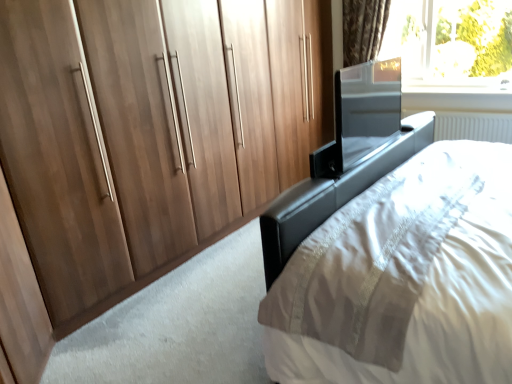
Question: Considering the relative sizes of walnut wood wardrobe at left and transparent glass window at upper right in the image provided, is walnut wood wardrobe at left taller than transparent glass window at upper right?

Choices:
 (A) no
 (B) yes

Answer: (B)

Question: Does walnut wood wardrobe at left come in front of transparent glass window at upper right?

Choices:
 (A) yes
 (B) no

Answer: (A)

Question: Is transparent glass window at upper right inside walnut wood wardrobe at left?

Choices:
 (A) yes
 (B) no

Answer: (B)

Question: From the image's perspective, is walnut wood wardrobe at left beneath transparent glass window at upper right?

Choices:
 (A) yes
 (B) no

Answer: (A)

Question: Is walnut wood wardrobe at left thinner than transparent glass window at upper right?

Choices:
 (A) no
 (B) yes

Answer: (A)

Question: Considering the relative sizes of walnut wood wardrobe at left and transparent glass window at upper right in the image provided, is walnut wood wardrobe at left bigger than transparent glass window at upper right?

Choices:
 (A) no
 (B) yes

Answer: (B)

Question: Is walnut wood wardrobe at left located outside black leather bed at center?

Choices:
 (A) no
 (B) yes

Answer: (B)

Question: From a real-world perspective, is walnut wood wardrobe at left positioned over black leather bed at center based on gravity?

Choices:
 (A) no
 (B) yes

Answer: (B)

Question: Is walnut wood wardrobe at left to the right of black leather bed at center from the viewer's perspective?

Choices:
 (A) yes
 (B) no

Answer: (B)

Question: Considering the relative positions of walnut wood wardrobe at left and black leather bed at center in the image provided, is walnut wood wardrobe at left to the left of black leather bed at center from the viewer's perspective?

Choices:
 (A) yes
 (B) no

Answer: (A)

Question: Is walnut wood wardrobe at left turned away from black leather bed at center?

Choices:
 (A) yes
 (B) no

Answer: (A)

Question: Considering the relative sizes of walnut wood wardrobe at left and black leather bed at center in the image provided, is walnut wood wardrobe at left bigger than black leather bed at center?

Choices:
 (A) no
 (B) yes

Answer: (B)

Question: Is walnut wood wardrobe at left completely or partially inside black leather bed at center?

Choices:
 (A) yes
 (B) no

Answer: (B)